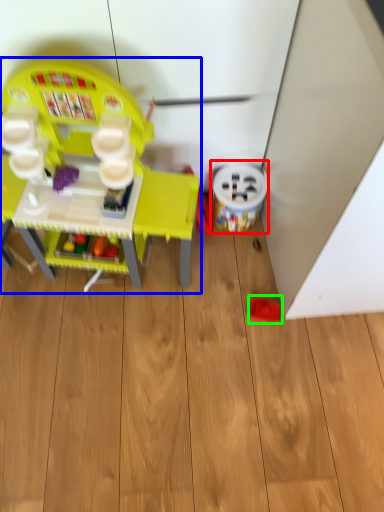
Question: Which object is positioned closest to toy (highlighted by a red box)? Select from toy (highlighted by a blue box) and toy (highlighted by a green box).

Choices:
 (A) toy
 (B) toy

Answer: (B)